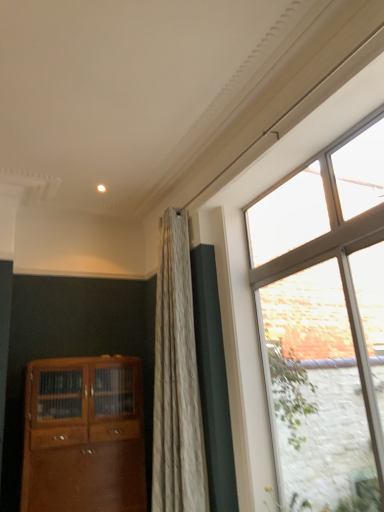
Question: Is clear glass window at right wider or thinner than clear glass door at right?

Choices:
 (A) thin
 (B) wide

Answer: (A)

Question: Is point (274, 274) positioned closer to the camera than point (380, 473)?

Choices:
 (A) closer
 (B) farther

Answer: (B)

Question: Which object is the closest to the matte wood cabinet at lower left?

Choices:
 (A) clear glass window at right
 (B) clear glass door at right

Answer: (A)

Question: Which object is the farthest from the clear glass window at right?

Choices:
 (A) clear glass door at right
 (B) matte wood cabinet at lower left

Answer: (B)